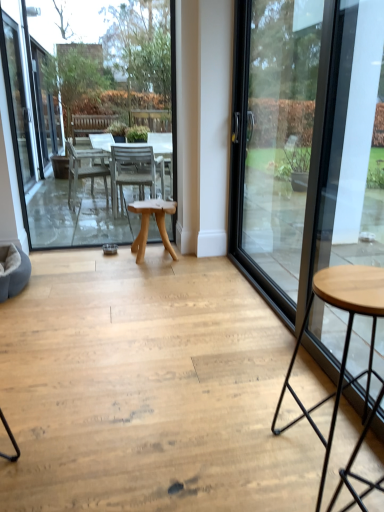
Question: From the image's perspective, is metallic black stool at lower right on transparent glass door at right?

Choices:
 (A) no
 (B) yes

Answer: (A)

Question: Is metallic black stool at lower right taller than transparent glass door at right?

Choices:
 (A) yes
 (B) no

Answer: (B)

Question: Considering the relative positions of metallic black stool at lower right and transparent glass door at right in the image provided, is metallic black stool at lower right to the right of transparent glass door at right from the viewer's perspective?

Choices:
 (A) yes
 (B) no

Answer: (B)

Question: Is metallic black stool at lower right at the left side of transparent glass door at right?

Choices:
 (A) yes
 (B) no

Answer: (A)

Question: From a real-world perspective, is metallic black stool at lower right on transparent glass door at right?

Choices:
 (A) no
 (B) yes

Answer: (A)

Question: Is metallic black stool at lower right bigger than transparent glass door at right?

Choices:
 (A) yes
 (B) no

Answer: (B)

Question: Would you say metallic black stool at lower right contains natural wood table at center?

Choices:
 (A) no
 (B) yes

Answer: (A)

Question: Is metallic black stool at lower right touching natural wood table at center?

Choices:
 (A) yes
 (B) no

Answer: (B)

Question: Is metallic black stool at lower right not close to natural wood table at center?

Choices:
 (A) yes
 (B) no

Answer: (A)

Question: Does metallic black stool at lower right have a greater width compared to natural wood table at center?

Choices:
 (A) yes
 (B) no

Answer: (B)

Question: Is metallic black stool at lower right not inside natural wood table at center?

Choices:
 (A) no
 (B) yes

Answer: (B)

Question: From the image's perspective, is metallic black stool at lower right located beneath natural wood table at center?

Choices:
 (A) yes
 (B) no

Answer: (A)

Question: Considering the relative positions of transparent glass door at right and wooden table at center in the image provided, is transparent glass door at right to the right of wooden table at center from the viewer's perspective?

Choices:
 (A) no
 (B) yes

Answer: (B)